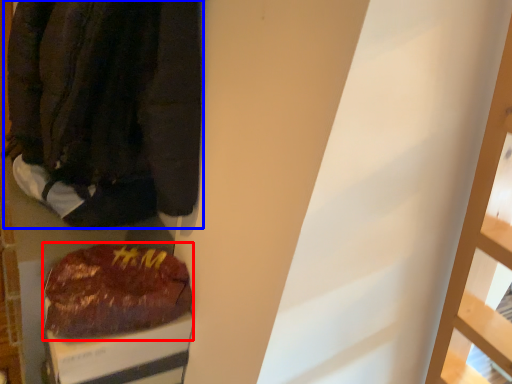
Question: Which object is closer to the camera taking this photo, food (highlighted by a red box) or jacket (highlighted by a blue box)?

Choices:
 (A) food
 (B) jacket

Answer: (B)